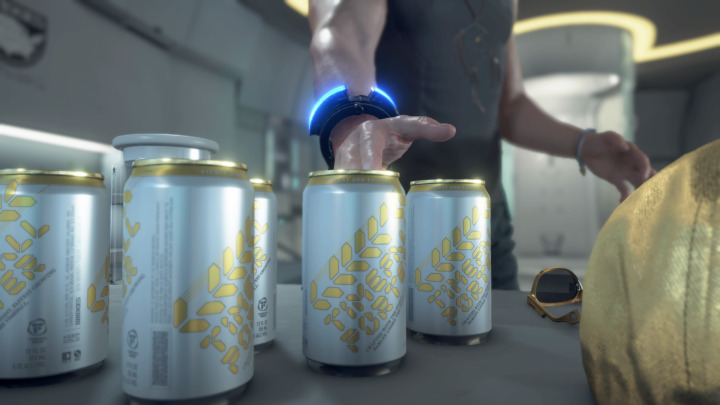
Identify the location of the chest. This screenshot has height=405, width=720. (448, 11), (497, 11).